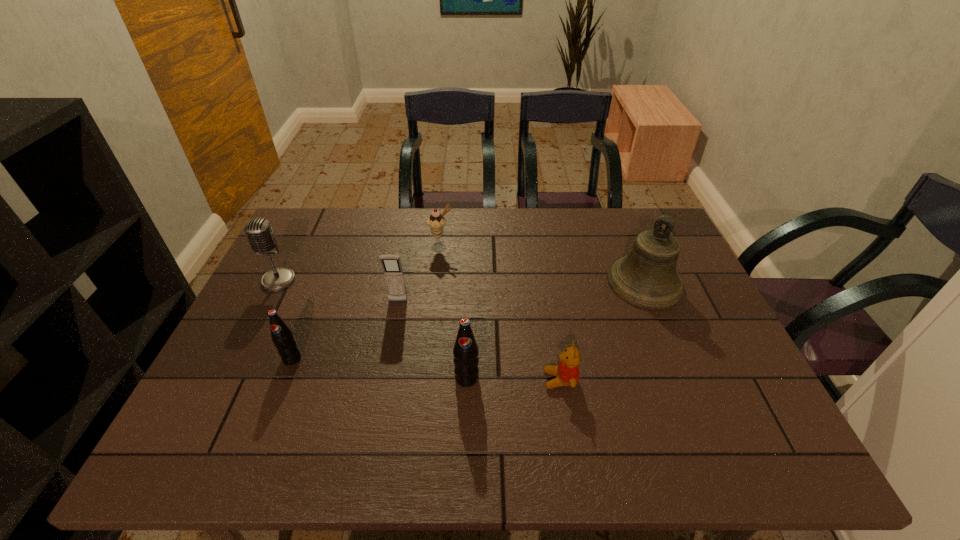
The height and width of the screenshot is (540, 960). What are the coordinates of `free space for a new pop on the right` in the screenshot? It's located at (657, 400).